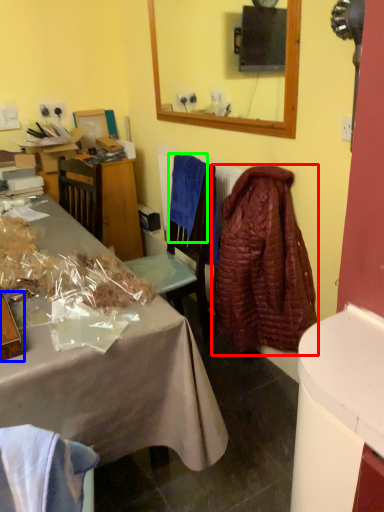
Question: Which object is positioned farthest from robe (highlighted by a red box)? Select from box (highlighted by a blue box) and cloth (highlighted by a green box).

Choices:
 (A) box
 (B) cloth

Answer: (A)